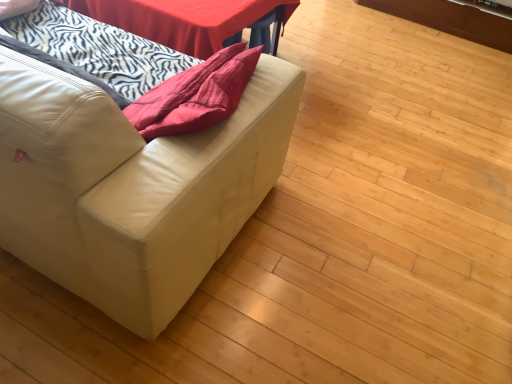
Image resolution: width=512 pixels, height=384 pixels. What do you see at coordinates (131, 187) in the screenshot?
I see `white leather couch at left` at bounding box center [131, 187].

Measure the distance between white zebra-patterned blanket at left and camera.

white zebra-patterned blanket at left and camera are 3.61 feet apart from each other.

What are the coordinates of `smooth red table at upper center` in the screenshot? It's located at (184, 19).

Considering the sizes of white zebra-patterned blanket at left and white leather couch at left in the image, is white zebra-patterned blanket at left bigger or smaller than white leather couch at left?

Clearly, white zebra-patterned blanket at left is smaller in size than white leather couch at left.

From a real-world perspective, does white zebra-patterned blanket at left sit lower than white leather couch at left?

Result: No, from a real-world perspective, white zebra-patterned blanket at left is not beneath white leather couch at left.

Is white zebra-patterned blanket at left shorter than white leather couch at left?

Yes.

From the image's perspective, which is above, white zebra-patterned blanket at left or white leather couch at left?

white zebra-patterned blanket at left is shown above in the image.

Which of these two, white leather couch at left or smooth red table at upper center, is bigger?

With larger size is white leather couch at left.

From a real-world perspective, which is physically above, white leather couch at left or smooth red table at upper center?

white leather couch at left, from a real-world perspective.

Is white leather couch at left positioned before smooth red table at upper center?

Yes, white leather couch at left is in front of smooth red table at upper center.

Between white zebra-patterned blanket at left and smooth red table at upper center, which one has larger size?

With larger size is smooth red table at upper center.

Which is behind, point (113, 48) or point (136, 7)?

Point (136, 7)

Where is `table lying above the white zebra-patterned blanket at left (from the image's perspective)`? table lying above the white zebra-patterned blanket at left (from the image's perspective) is located at coordinates (184, 19).

Are white zebra-patterned blanket at left and smooth red table at upper center far apart?

No, there isn't a large distance between white zebra-patterned blanket at left and smooth red table at upper center.

Is smooth red table at upper center inside or outside of white leather couch at left?

Result: smooth red table at upper center cannot be found inside white leather couch at left.

Image resolution: width=512 pixels, height=384 pixels. In the image, there is a white leather couch at left. Find the location of `table below it (from a real-world perspective)`. table below it (from a real-world perspective) is located at coordinates (184, 19).

Considering the relative positions of smooth red table at upper center and white leather couch at left in the image provided, is smooth red table at upper center to the left of white leather couch at left from the viewer's perspective?

No, smooth red table at upper center is not to the left of white leather couch at left.

Between smooth red table at upper center and white leather couch at left, which one has less height?

With less height is smooth red table at upper center.

From a real-world perspective, who is located higher, white leather couch at left or white zebra-patterned blanket at left?

white zebra-patterned blanket at left, from a real-world perspective.

In terms of size, does white leather couch at left appear bigger or smaller than white zebra-patterned blanket at left?

In the image, white leather couch at left appears to be larger than white zebra-patterned blanket at left.

Which object is positioned more to the right, white leather couch at left or white zebra-patterned blanket at left?

white zebra-patterned blanket at left.

In the scene shown: Does smooth red table at upper center have a lesser height compared to white zebra-patterned blanket at left?

Indeed, smooth red table at upper center has a lesser height compared to white zebra-patterned blanket at left.

From a real-world perspective, which is physically below, smooth red table at upper center or white zebra-patterned blanket at left?

smooth red table at upper center is physically lower.

Does smooth red table at upper center have a greater width compared to white zebra-patterned blanket at left?

Yes, smooth red table at upper center is wider than white zebra-patterned blanket at left.

From the image's perspective, would you say smooth red table at upper center is positioned over white zebra-patterned blanket at left?

Indeed, from the image's perspective, smooth red table at upper center is shown above white zebra-patterned blanket at left.

The width and height of the screenshot is (512, 384). In order to click on blanket located above the white leather couch at left (from a real-world perspective) in this screenshot , I will do `click(93, 51)`.

Find the location of a particular element. This screenshot has width=512, height=384. studio couch on the left side of smooth red table at upper center is located at coordinates (131, 187).

Looking at the image, which one is located closer to white leather couch at left, smooth red table at upper center or white zebra-patterned blanket at left?

white zebra-patterned blanket at left is positioned closer to the anchor white leather couch at left.

Considering their positions, is smooth red table at upper center positioned closer to white zebra-patterned blanket at left than white leather couch at left?

smooth red table at upper center lies closer to white zebra-patterned blanket at left than the other object.

When comparing their distances from white zebra-patterned blanket at left, does white leather couch at left or smooth red table at upper center seem closer?

The object closer to white zebra-patterned blanket at left is smooth red table at upper center.

Considering their positions, is white leather couch at left positioned closer to smooth red table at upper center than white zebra-patterned blanket at left?

Based on the image, white zebra-patterned blanket at left appears to be nearer to smooth red table at upper center.

Looking at the image, which one is located closer to smooth red table at upper center, white zebra-patterned blanket at left or white leather couch at left?

Among the two, white zebra-patterned blanket at left is located nearer to smooth red table at upper center.

Estimate the real-world distances between objects in this image. Which object is closer to white leather couch at left, white zebra-patterned blanket at left or smooth red table at upper center?

Among the two, white zebra-patterned blanket at left is located nearer to white leather couch at left.

I want to click on blanket located between white leather couch at left and smooth red table at upper center in the depth direction, so 93,51.